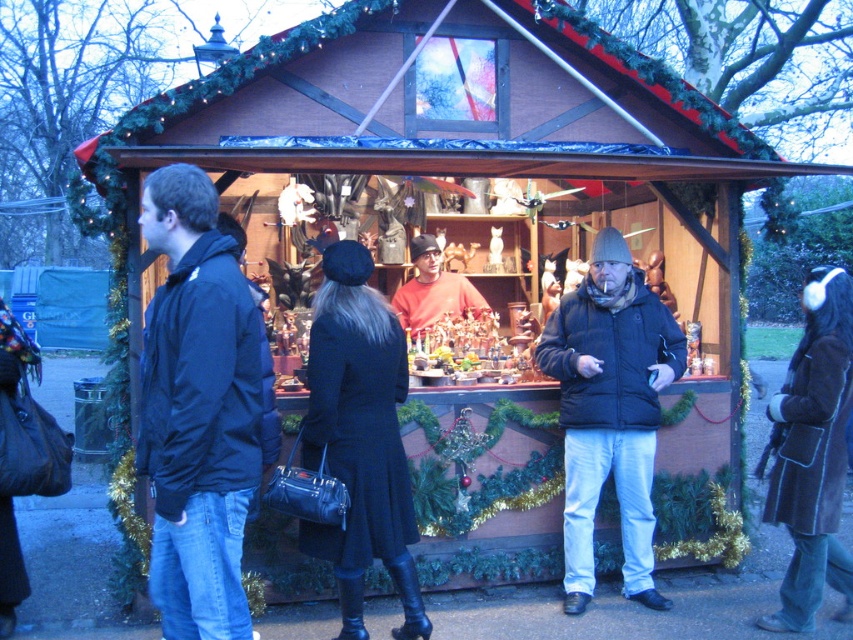
Between dark blue jacket at left and brown suede coat at lower right, which one has less height?

brown suede coat at lower right

Is point (204, 412) positioned before point (828, 424)?

Yes, point (204, 412) is closer to viewer.

Measure the distance between dark blue jacket at left and camera.

They are 10.05 feet apart.

This screenshot has width=853, height=640. Find the location of `dark blue jacket at left`. dark blue jacket at left is located at coordinates click(x=196, y=410).

Does black matte jacket at center appear under dark blue leather coat at center?

Incorrect, black matte jacket at center is not positioned below dark blue leather coat at center.

Between black matte jacket at center and dark blue leather coat at center, which one is positioned higher?

Positioned higher is black matte jacket at center.

This screenshot has width=853, height=640. In order to click on black matte jacket at center in this screenshot , I will do `click(610, 410)`.

Is dark blue jacket at left closer to camera compared to black matte jacket at center?

Yes, it is.

Between dark blue jacket at left and black matte jacket at center, which one has more height?

Standing taller between the two is black matte jacket at center.

Is point (225, 467) positioned behind point (612, 403)?

No, (225, 467) is closer to viewer.

At what (x,y) coordinates should I click in order to perform the action: click on dark blue jacket at left. Please return your answer as a coordinate pair (x, y). The width and height of the screenshot is (853, 640). Looking at the image, I should click on (196, 410).